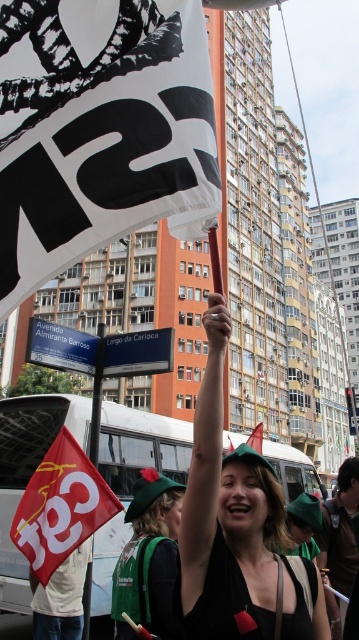
Can you confirm if white paper flag at upper center is taller than white fabric flag at center?

In fact, white paper flag at upper center may be shorter than white fabric flag at center.

Can you confirm if white paper flag at upper center is shorter than white fabric flag at center?

Correct, white paper flag at upper center is not as tall as white fabric flag at center.

Is point (174, 156) positioned before point (262, 429)?

Yes, it is in front of point (262, 429).

Identify the location of white paper flag at upper center. (103, 132).

Is green felt hat at upper center to the right of white fabric flag at center from the viewer's perspective?

Incorrect, green felt hat at upper center is not on the right side of white fabric flag at center.

Can you confirm if green felt hat at upper center is smaller than white fabric flag at center?

Indeed, green felt hat at upper center has a smaller size compared to white fabric flag at center.

Does point (286, 620) lie behind point (249, 444)?

No, (286, 620) is closer to viewer.

I want to click on green felt hat at upper center, so click(x=226, y=516).

Which is behind, point (255, 572) or point (99, 500)?

The point (99, 500) is behind.

Is green felt hat at upper center below white paper flag at center?

Incorrect, green felt hat at upper center is not positioned below white paper flag at center.

This screenshot has width=359, height=640. I want to click on green felt hat at upper center, so click(226, 516).